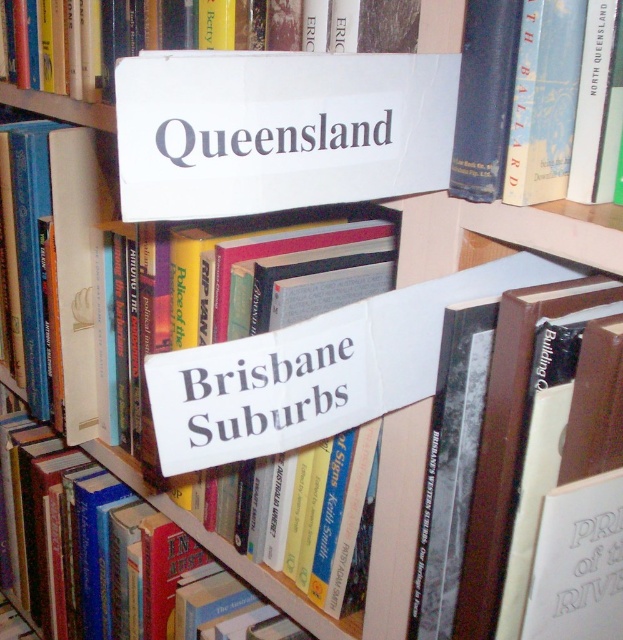
Question: Which point appears closest to the camera in this image?

Choices:
 (A) (350, 369)
 (B) (611, 58)

Answer: (A)

Question: Considering the relative positions of blue hardcover book at upper right and white paper sign at center in the image provided, where is blue hardcover book at upper right located with respect to white paper sign at center?

Choices:
 (A) right
 (B) left

Answer: (A)

Question: Which point is closer to the camera?

Choices:
 (A) (361, 372)
 (B) (535, 141)

Answer: (B)

Question: Does blue hardcover book at upper right appear on the left side of white paper sign at center?

Choices:
 (A) yes
 (B) no

Answer: (B)

Question: Can you confirm if blue hardcover book at upper right is smaller than white paper sign at center?

Choices:
 (A) yes
 (B) no

Answer: (B)